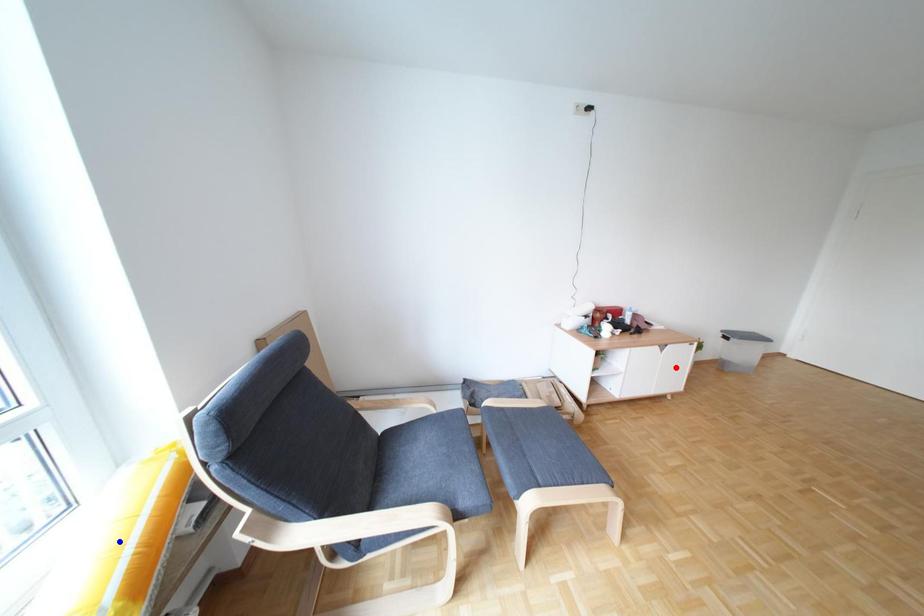
Question: Two points are marked on the image. Which point is closer to the camera?

Choices:
 (A) Blue point is closer.
 (B) Red point is closer.

Answer: (A)